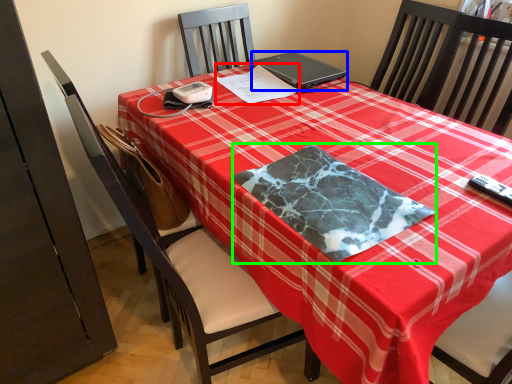
Question: Which object is the farthest from notepad (highlighted by a red box)? Choose among these: laptop (highlighted by a blue box) or blanket (highlighted by a green box).

Choices:
 (A) laptop
 (B) blanket

Answer: (B)